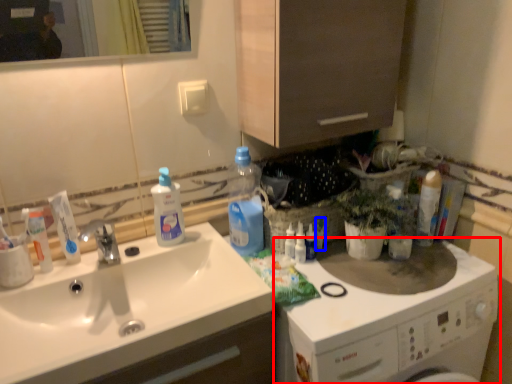
Question: Which of the following is the farthest to the observer, washing machine (highlighted by a red box) or toiletry (highlighted by a blue box)?

Choices:
 (A) washing machine
 (B) toiletry

Answer: (B)